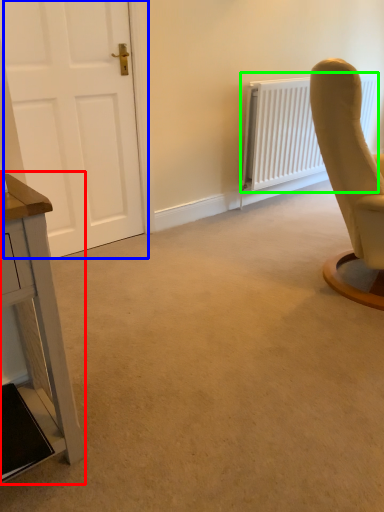
Question: Which object is positioned closest to table (highlighted by a red box)? Select from door (highlighted by a blue box) and radiator (highlighted by a green box).

Choices:
 (A) door
 (B) radiator

Answer: (A)